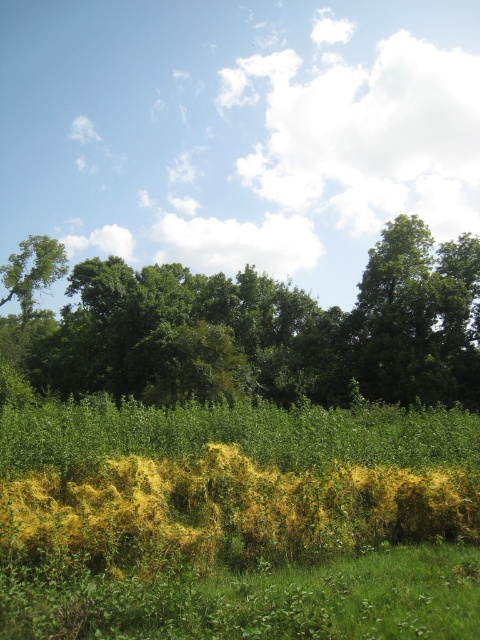
Question: Considering the real-world distances, which object is closest to the green leafy tree at upper left?

Choices:
 (A) green leafy tree at upper right
 (B) green leafy tree at center

Answer: (B)

Question: Is green leafy tree at center smaller than green leafy tree at upper right?

Choices:
 (A) no
 (B) yes

Answer: (A)

Question: Can you confirm if green leafy tree at upper right is thinner than green leafy tree at upper left?

Choices:
 (A) no
 (B) yes

Answer: (A)

Question: Among these objects, which one is nearest to the camera?

Choices:
 (A) green leafy tree at upper left
 (B) green leafy tree at center
 (C) green leafy tree at upper right

Answer: (B)

Question: Can you confirm if green leafy tree at center is smaller than green leafy tree at upper right?

Choices:
 (A) no
 (B) yes

Answer: (A)

Question: Which object appears farthest from the camera in this image?

Choices:
 (A) green leafy tree at upper left
 (B) green leafy tree at center
 (C) green leafy tree at upper right

Answer: (A)